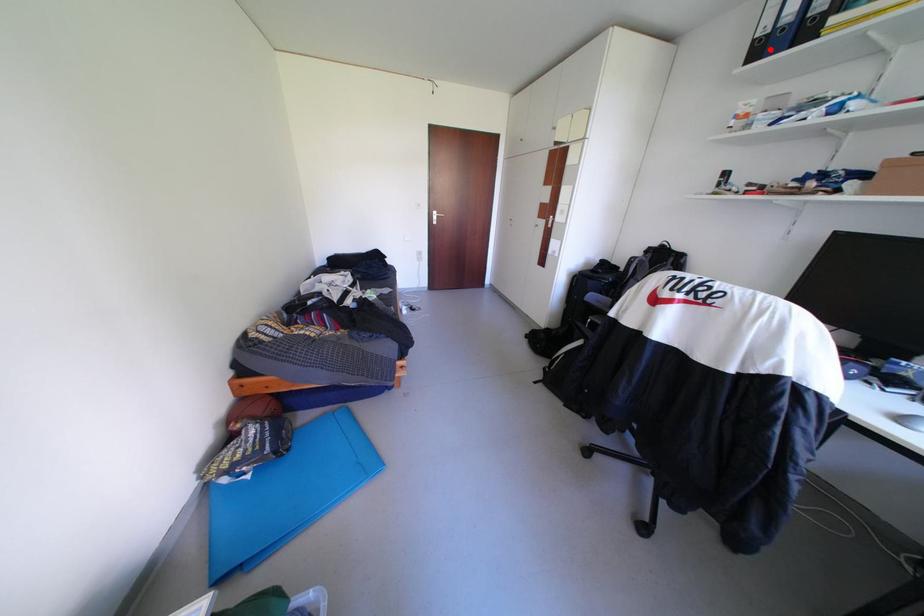
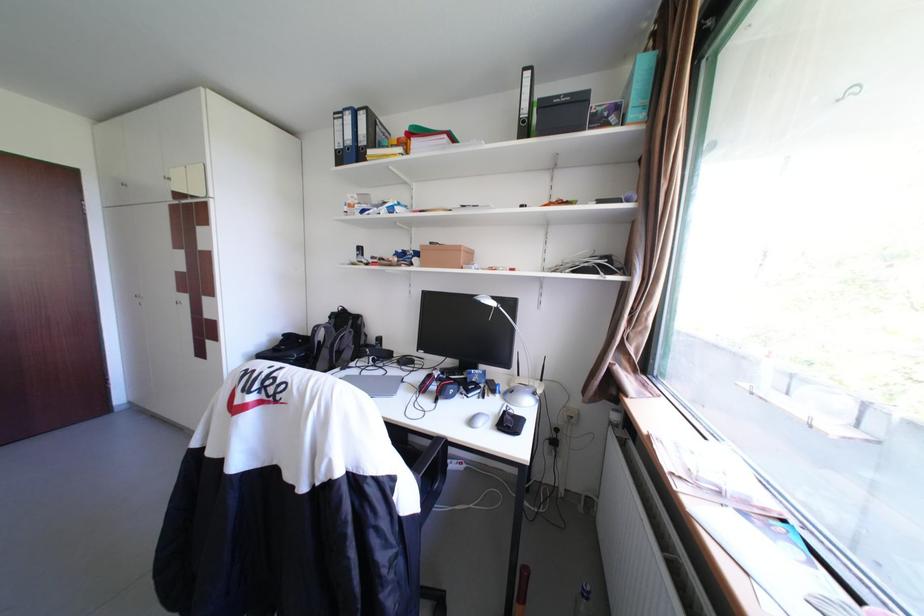
Question: I am providing you with two images of the same scene from different viewpoints. In image1, a red point is highlighted. Considering the same 3D point in image2, which of the following is correct?

Choices:
 (A) It is closer
 (B) It is farther

Answer: (A)